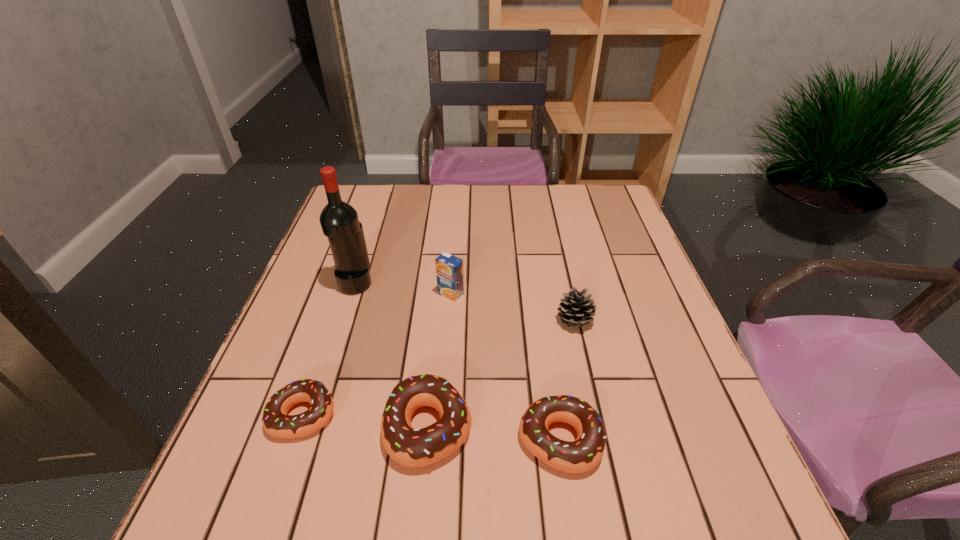
Please point a vacant point for placing a doughnut on the right. Please provide its 2D coordinates. Your answer should be formatted as a tuple, i.e. [(x, y)], where the tuple contains the x and y coordinates of a point satisfying the conditions above.

[(698, 455)]